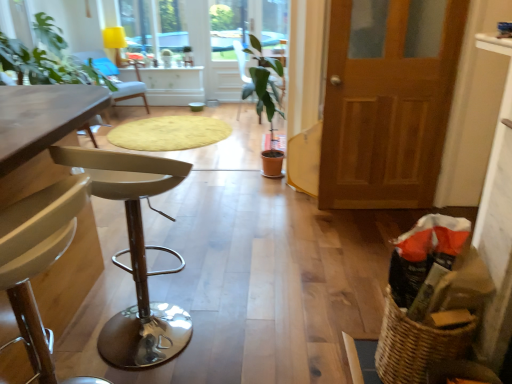
Question: Is wooden table at left, which ranks as the first table in left-to-right order, oriented towards yellow fabric lampshade at upper center?

Choices:
 (A) yes
 (B) no

Answer: (B)

Question: Does wooden table at left, which ranks as the 1th table in back-to-front order, have a larger size compared to yellow fabric lampshade at upper center?

Choices:
 (A) yes
 (B) no

Answer: (A)

Question: From a real-world perspective, is wooden table at left, which ranks as the 1th table in back-to-front order, positioned under yellow fabric lampshade at upper center based on gravity?

Choices:
 (A) yes
 (B) no

Answer: (A)

Question: From the image's perspective, is wooden table at left, the second table viewed from the right, beneath yellow fabric lampshade at upper center?

Choices:
 (A) no
 (B) yes

Answer: (B)

Question: Does wooden table at left, the second table viewed from the right, have a lesser height compared to yellow fabric lampshade at upper center?

Choices:
 (A) yes
 (B) no

Answer: (B)

Question: From a real-world perspective, is wooden table at left, which ranks as the first table in left-to-right order, on yellow fabric lampshade at upper center?

Choices:
 (A) yes
 (B) no

Answer: (B)

Question: Is woven brown basket at lower right positioned far away from wooden door at right?

Choices:
 (A) yes
 (B) no

Answer: (A)

Question: Does woven brown basket at lower right appear on the right side of wooden door at right?

Choices:
 (A) yes
 (B) no

Answer: (B)

Question: Is woven brown basket at lower right looking in the opposite direction of wooden door at right?

Choices:
 (A) no
 (B) yes

Answer: (A)

Question: Considering the relative sizes of woven brown basket at lower right and wooden door at right in the image provided, is woven brown basket at lower right wider than wooden door at right?

Choices:
 (A) yes
 (B) no

Answer: (A)

Question: Considering the relative sizes of woven brown basket at lower right and wooden door at right in the image provided, is woven brown basket at lower right thinner than wooden door at right?

Choices:
 (A) yes
 (B) no

Answer: (B)

Question: Is woven brown basket at lower right placed right next to wooden door at right?

Choices:
 (A) yes
 (B) no

Answer: (B)

Question: Is the surface of woven brown basket at lower right in direct contact with wooden table at left, which is the 2th table from back to front?

Choices:
 (A) no
 (B) yes

Answer: (A)